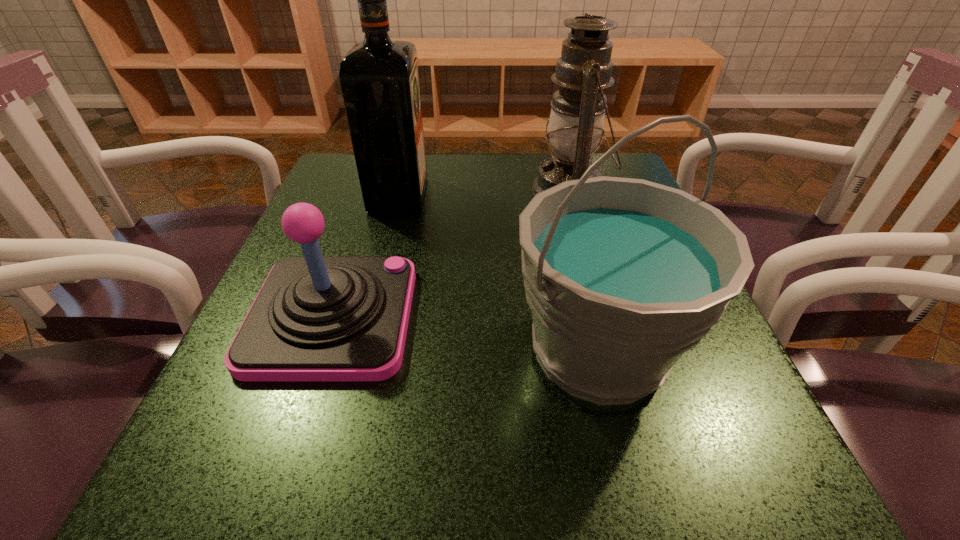
The image size is (960, 540). In the image, there is a desktop. In order to click on free space at the near right corner in this screenshot , I will do `click(749, 487)`.

Locate an element on the screen. The image size is (960, 540). free spot between the oil lamp and the joystick is located at coordinates (451, 254).

Locate an element on the screen. Image resolution: width=960 pixels, height=540 pixels. unoccupied area between the joystick and the bucket is located at coordinates (466, 333).

You are a GUI agent. You are given a task and a screenshot of the screen. Output one action in this format:
    pyautogui.click(x=<x>, y=<y>)
    Task: Click on the vacant area that lies between the joystick and the liquor
    The width and height of the screenshot is (960, 540).
    Given the screenshot: What is the action you would take?
    pyautogui.click(x=366, y=256)

The width and height of the screenshot is (960, 540). What are the coordinates of `free space between the joystick and the bucket` in the screenshot? It's located at (466, 333).

Where is `empty space that is in between the oil lamp and the liquor`? The height and width of the screenshot is (540, 960). empty space that is in between the oil lamp and the liquor is located at coordinates [x=484, y=193].

At what (x,y) coordinates should I click in order to perform the action: click on free spot between the liquor and the bucket. Please return your answer as a coordinate pair (x, y). Looking at the image, I should click on (498, 272).

Find the location of a particular element. The width and height of the screenshot is (960, 540). free space between the liquor and the bucket is located at coordinates (498, 272).

The height and width of the screenshot is (540, 960). I want to click on free space between the liquor and the shortest object, so click(x=366, y=256).

In order to click on vacant area between the oil lamp and the liquor in this screenshot , I will do pos(484,193).